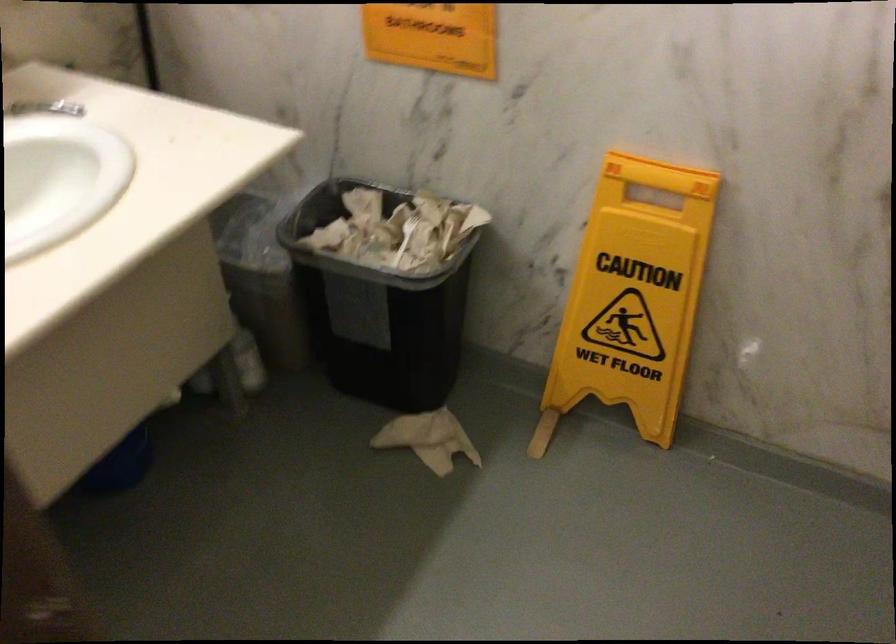
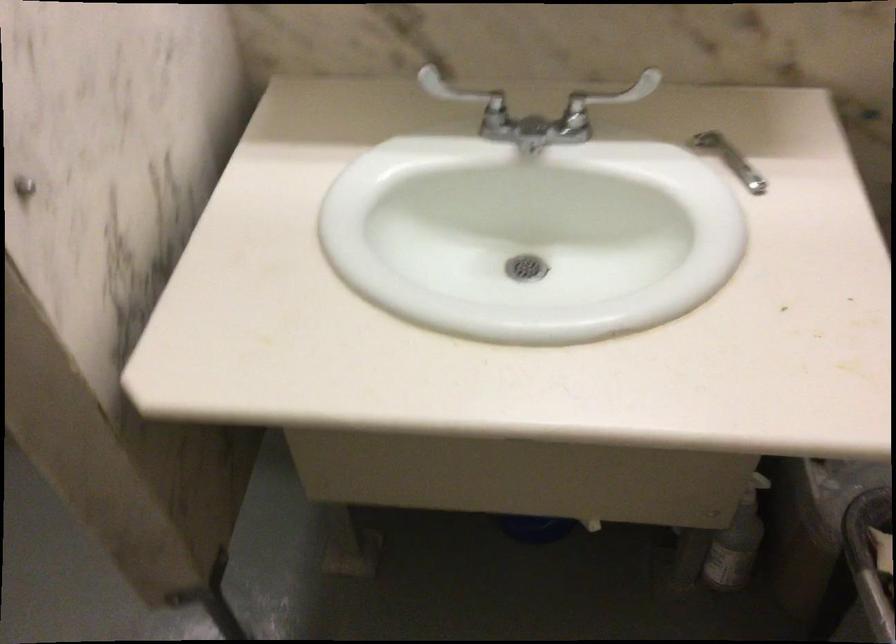
The point at [250,348] is marked in the first image. Where is the corresponding point in the second image?

(737, 542)